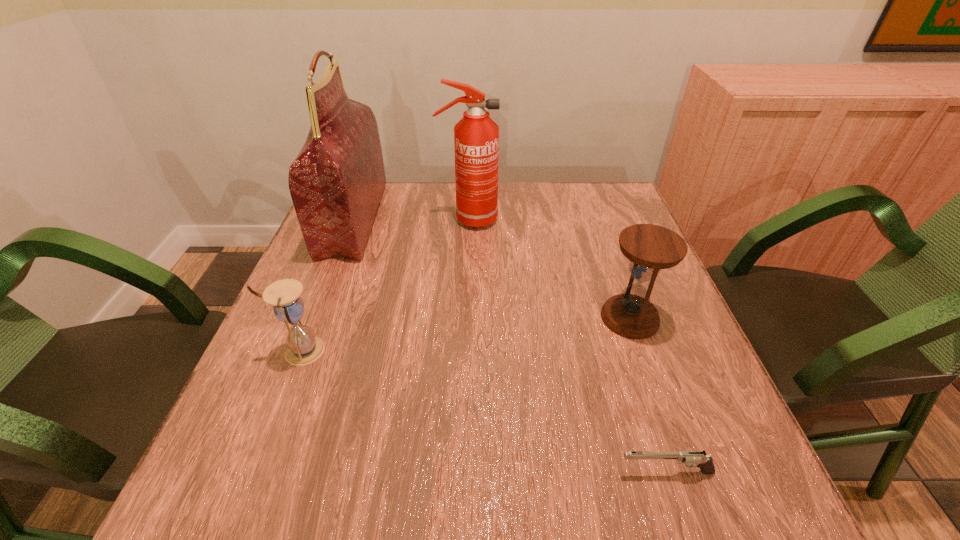
I want to click on vacant region located on the front of the left hourglass, so click(x=242, y=502).

Where is `blank space located 0.110m on the front-facing side of the nearest object`? The image size is (960, 540). blank space located 0.110m on the front-facing side of the nearest object is located at coordinates (547, 472).

In order to click on vacant area located 0.330m on the front-facing side of the nearest object in this screenshot , I will do `click(405, 472)`.

Locate an element on the screen. free point located on the front-facing side of the nearest object is located at coordinates (424, 472).

This screenshot has width=960, height=540. I want to click on handbag that is at the far edge, so click(336, 182).

At what (x,y) coordinates should I click in order to perform the action: click on fire extinguisher located at the far edge. Please return your answer as a coordinate pair (x, y). Looking at the image, I should click on (476, 136).

Find the location of a particular element. object present at the near edge is located at coordinates (x=698, y=459).

Locate an element on the screen. handbag at the left edge is located at coordinates (336, 182).

Locate an element on the screen. hourglass present at the left edge is located at coordinates (304, 347).

Locate an element on the screen. hourglass that is at the right edge is located at coordinates (650, 248).